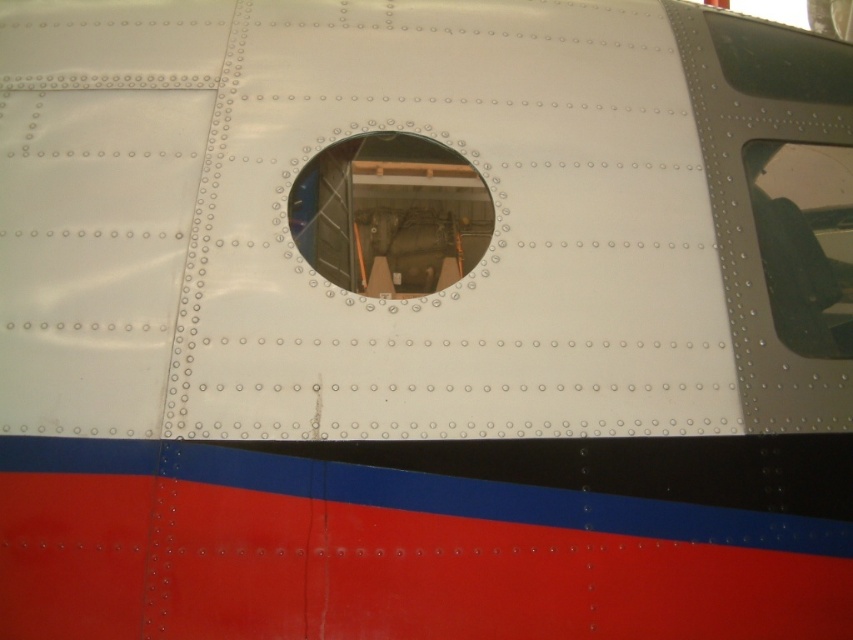
Can you confirm if glossy metal porthole at center is taller than clear glass window at upper right?

No, glossy metal porthole at center is not taller than clear glass window at upper right.

Who is higher up, glossy metal porthole at center or clear glass window at upper right?

glossy metal porthole at center is higher up.

Does point (309, 243) come closer to viewer compared to point (817, 189)?

Yes, point (309, 243) is in front of point (817, 189).

Identify the location of glossy metal porthole at center. This screenshot has height=640, width=853. (390, 214).